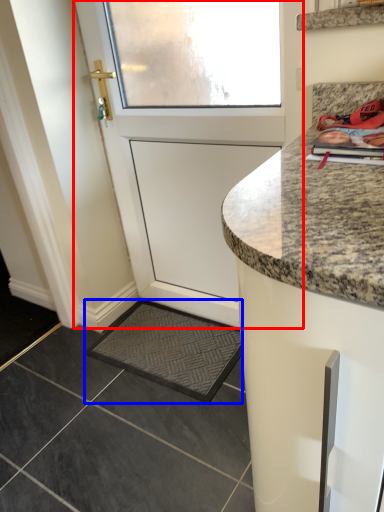
Question: Among these objects, which one is nearest to the camera, door (highlighted by a red box) or slate (highlighted by a blue box)?

Choices:
 (A) door
 (B) slate

Answer: (A)